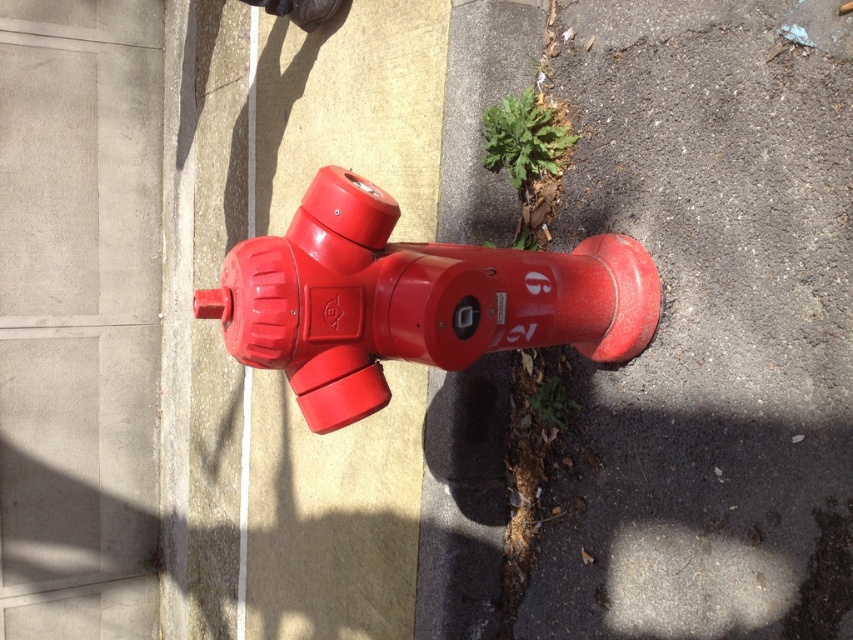
Which is below, smooth asphalt at lower right or glossy plastic hydrant at center?

smooth asphalt at lower right is below.

Looking at this image, does smooth asphalt at lower right have a lesser height compared to glossy plastic hydrant at center?

No.

This screenshot has width=853, height=640. Identify the location of smooth asphalt at lower right. (711, 326).

Locate an element on the screen. The image size is (853, 640). smooth asphalt at lower right is located at coordinates (711, 326).

Measure the distance between point (x=257, y=257) and camera.

A distance of 7.37 feet exists between point (x=257, y=257) and camera.

Between glossy plastic hydrant at center and green leafy plant at center, which one is positioned higher?

green leafy plant at center

Which is behind, point (378, 259) or point (514, 97)?

The point (514, 97) is more distant.

Image resolution: width=853 pixels, height=640 pixels. What are the coordinates of `glossy plastic hydrant at center` in the screenshot? It's located at click(412, 300).

Does smooth asphalt at lower right lie in front of green leafy plant at center?

That is True.

Is point (471, 545) more distant than point (515, 136)?

Yes, it is.

You are a GUI agent. You are given a task and a screenshot of the screen. Output one action in this format:
    pyautogui.click(x=<x>, y=<y>)
    Task: Click on the smooth asphalt at lower right
    This screenshot has height=640, width=853.
    Given the screenshot: What is the action you would take?
    click(x=711, y=326)

This screenshot has height=640, width=853. Find the location of `smooth asphalt at lower right`. smooth asphalt at lower right is located at coordinates (711, 326).